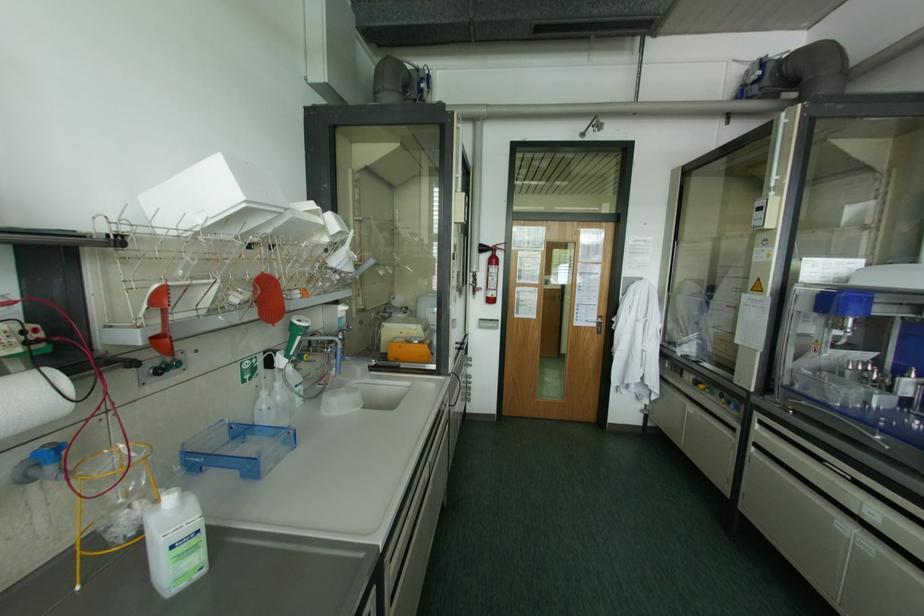
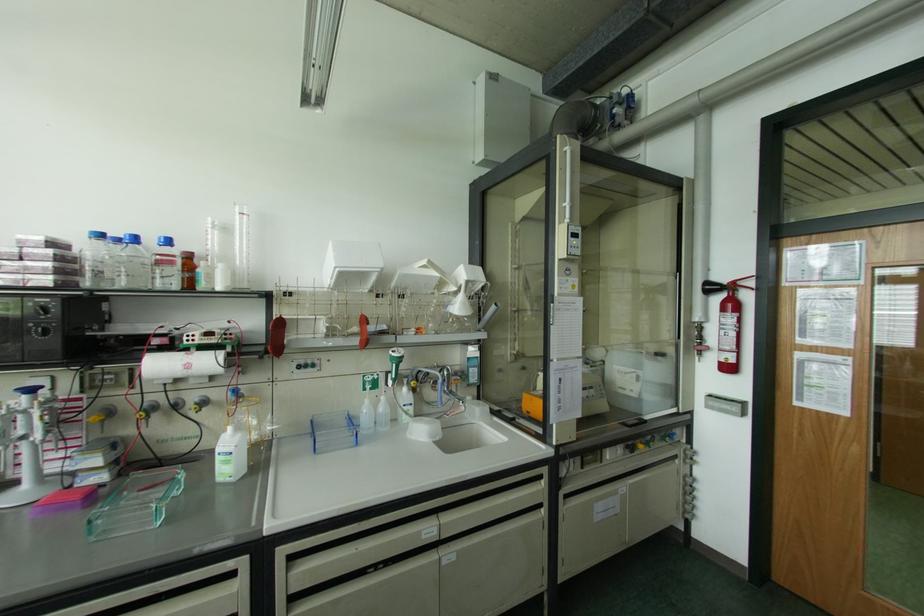
In the second image, find the point that corresponds to [480,245] in the first image.

(707, 283)